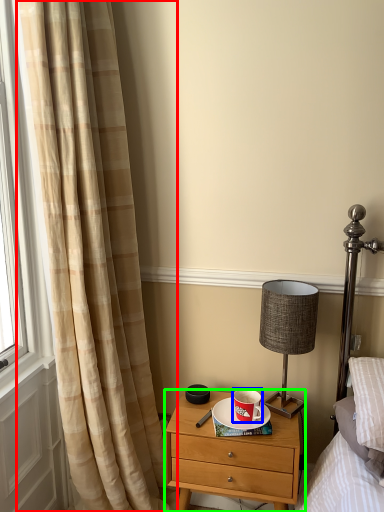
Question: Which object is positioned closest to curtain (highlighted by a red box)? Select from coffee cup (highlighted by a blue box) and nightstand (highlighted by a green box).

Choices:
 (A) coffee cup
 (B) nightstand

Answer: (B)